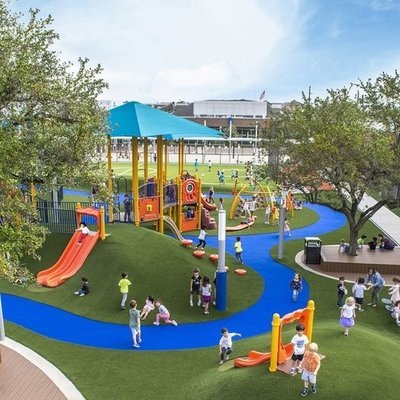
Identify the location of garbage can. The image size is (400, 400). (319, 247).